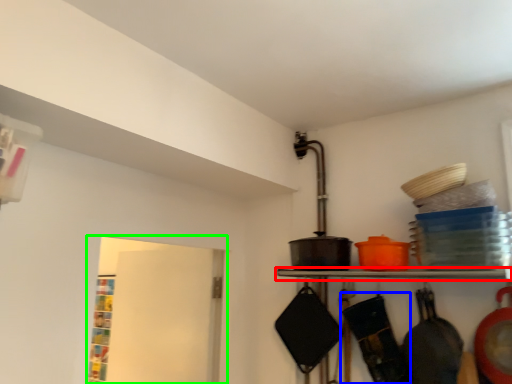
Question: Which object is the farthest from shelf (highlighted by a red box)? Choose among these: frying pan (highlighted by a blue box) or window (highlighted by a green box).

Choices:
 (A) frying pan
 (B) window

Answer: (B)